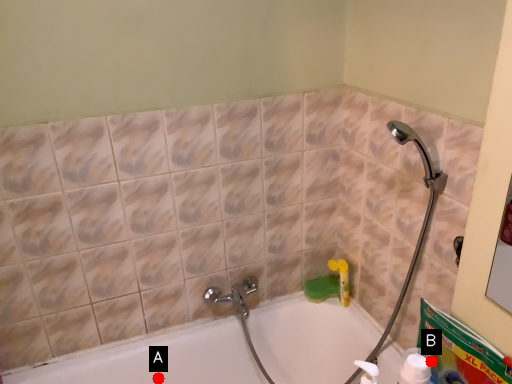
Question: Two points are circled on the image, labeled by A and B beside each circle. Which point is closer to the camera taking this photo?

Choices:
 (A) A is closer
 (B) B is closer

Answer: (B)